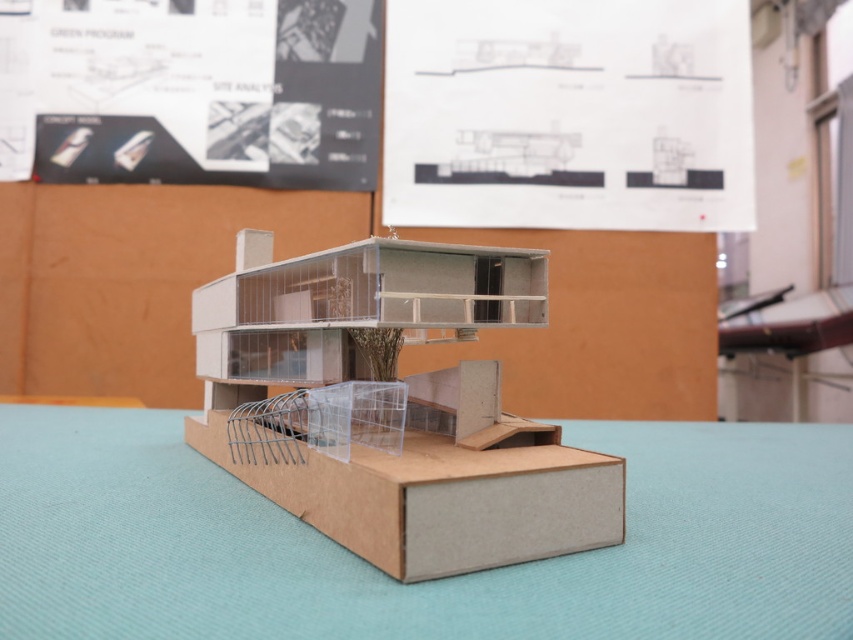
Is cardboard box at center closer to camera compared to brown cardboard box at lower center?

That is False.

Between cardboard box at center and brown cardboard box at lower center, which one appears on the left side from the viewer's perspective?

brown cardboard box at lower center is more to the left.

This screenshot has height=640, width=853. In order to click on cardboard box at center in this screenshot , I will do `click(393, 406)`.

Identify the location of cardboard box at center. The height and width of the screenshot is (640, 853). (393, 406).

Between brown cardboard table at center and cardboard box at center, which one is positioned lower?

Positioned lower is brown cardboard table at center.

Is brown cardboard table at center positioned behind cardboard box at center?

No.

Between point (171, 509) and point (305, 337), which one is positioned in front?

Point (171, 509)

At what (x,y) coordinates should I click in order to perform the action: click on brown cardboard table at center. Please return your answer as a coordinate pair (x, y). Looking at the image, I should click on (421, 582).

Is point (848, 547) positioned behind point (500, 480)?

That is True.

Is brown cardboard table at center thinner than brown cardboard box at lower center?

In fact, brown cardboard table at center might be wider than brown cardboard box at lower center.

Who is more forward, (555, 566) or (409, 442)?

Positioned in front is point (555, 566).

Locate an element on the screen. Image resolution: width=853 pixels, height=640 pixels. brown cardboard table at center is located at coordinates pos(421,582).